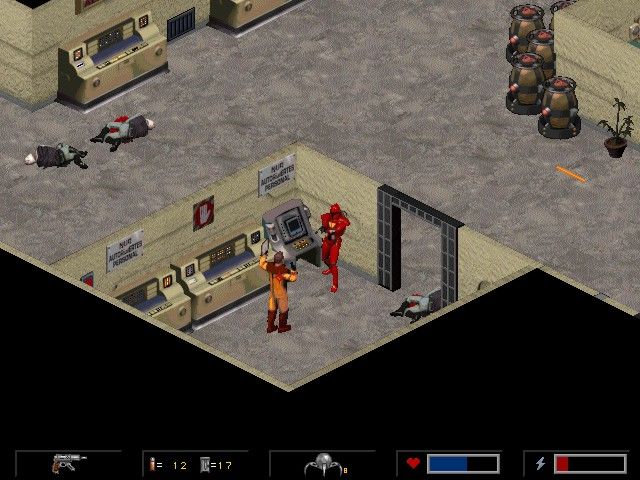
This screenshot has height=480, width=640. Find the location of `gray vent`. gray vent is located at coordinates (x=185, y=26).